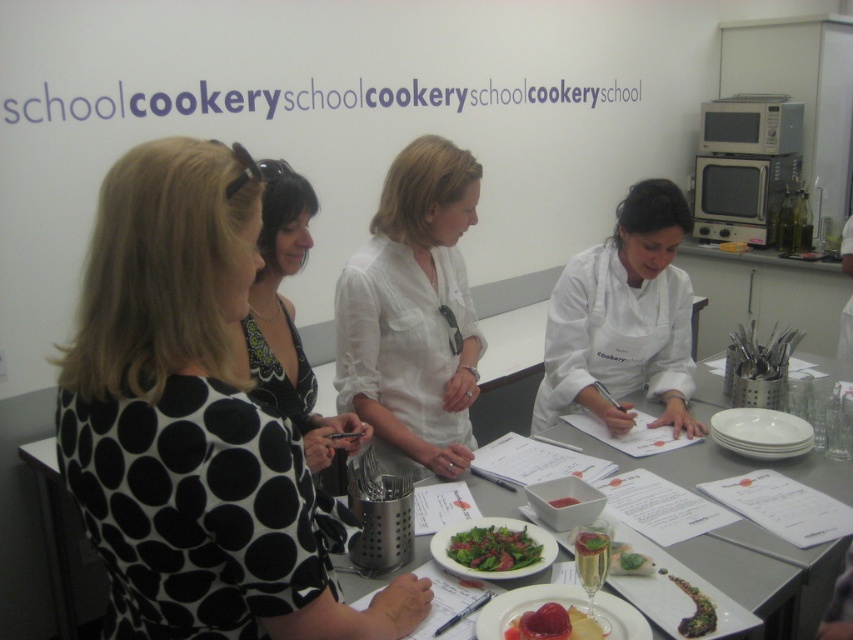
You are standing at the center of the image. Which direction should you move to reach the white glossy platter at lower right?

You should move to the lower right direction to reach the white glossy platter at lower right since it is located at point (759, 433), which is in the lower right quadrant of the image.

You are a participant in the cooking class and need to reach both the point at coordinates point (546, 412) and the point at coordinates point (775, 566). Which point will you reach first?

You will reach point (546, 412) first because it is closer to you than point (775, 566), which is further away.

You are a student in the cooking class and need to place the green leafy salad at center on top of the white glossy platter at lower right. Is this possible based on their sizes?

The white glossy platter at lower right is taller than the green leafy salad at center, so placing the salad on top of the platter is feasible since the platter can accommodate the salad without it toppling over.